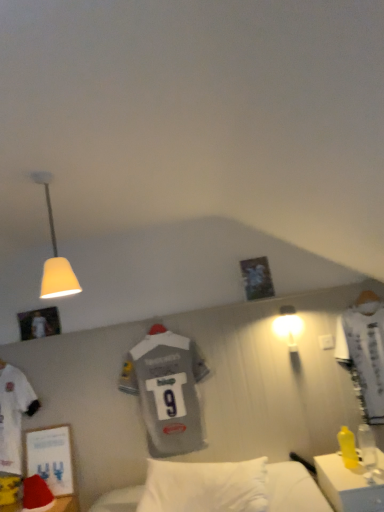
Question: Is gray jersey at center closer to camera compared to matte white bulb at upper right, which is the 1th lamp from back to front?

Choices:
 (A) yes
 (B) no

Answer: (B)

Question: Is gray jersey at center placed right next to matte white bulb at upper right, the 1th lamp ordered from the bottom?

Choices:
 (A) yes
 (B) no

Answer: (B)

Question: Does gray jersey at center lie behind matte white bulb at upper right, the first lamp from the right?

Choices:
 (A) no
 (B) yes

Answer: (B)

Question: Considering the relative sizes of gray jersey at center and matte white bulb at upper right, the first lamp from the right, in the image provided, is gray jersey at center shorter than matte white bulb at upper right, the first lamp from the right,?

Choices:
 (A) no
 (B) yes

Answer: (A)

Question: Is gray jersey at center aimed at matte white bulb at upper right, the first lamp from the right?

Choices:
 (A) no
 (B) yes

Answer: (A)

Question: Is gray jersey at center in front of or behind yellow plastic desk at lower right in the image?

Choices:
 (A) behind
 (B) front

Answer: (A)

Question: In the image, is gray jersey at center on the left side or the right side of yellow plastic desk at lower right?

Choices:
 (A) left
 (B) right

Answer: (A)

Question: Is gray jersey at center situated inside yellow plastic desk at lower right or outside?

Choices:
 (A) outside
 (B) inside

Answer: (A)

Question: Considering the positions of point (157, 375) and point (375, 482), is point (157, 375) closer or farther from the camera than point (375, 482)?

Choices:
 (A) farther
 (B) closer

Answer: (A)

Question: Looking at the image, does yellow plastic desk at lower right seem bigger or smaller compared to gray jersey at center?

Choices:
 (A) small
 (B) big

Answer: (B)

Question: From the image's perspective, is yellow plastic desk at lower right positioned above or below gray jersey at center?

Choices:
 (A) above
 (B) below

Answer: (B)

Question: Choose the correct answer: Is yellow plastic desk at lower right inside gray jersey at center or outside it?

Choices:
 (A) outside
 (B) inside

Answer: (A)

Question: Looking at their shapes, would you say yellow plastic desk at lower right is wider or thinner than gray jersey at center?

Choices:
 (A) wide
 (B) thin

Answer: (A)

Question: Considering the relative positions of matte white lampshade at upper left, the second lamp positioned from the right, and gray jersey at center in the image provided, is matte white lampshade at upper left, the second lamp positioned from the right, to the left or to the right of gray jersey at center?

Choices:
 (A) left
 (B) right

Answer: (A)

Question: Is matte white lampshade at upper left, the second lamp positioned from the right, taller or shorter than gray jersey at center?

Choices:
 (A) short
 (B) tall

Answer: (A)